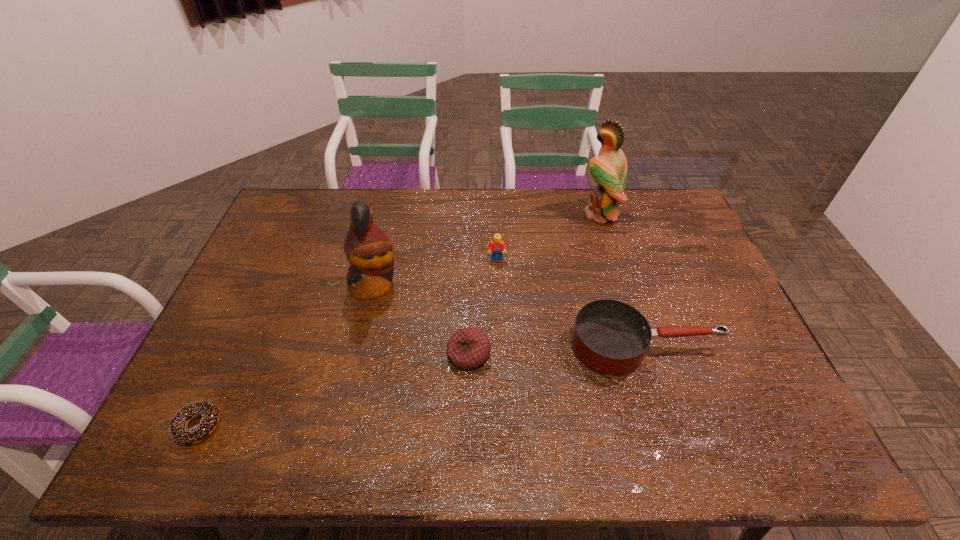
This screenshot has height=540, width=960. Identify the location of object that is at the right edge. (611, 337).

Image resolution: width=960 pixels, height=540 pixels. I want to click on object at the near left corner, so click(x=178, y=430).

The image size is (960, 540). What are the coordinates of `vacant space at the far edge` in the screenshot? It's located at (525, 217).

The height and width of the screenshot is (540, 960). I want to click on vacant space at the near edge of the desktop, so click(641, 427).

Identify the location of blank area at the left edge. This screenshot has width=960, height=540. (262, 258).

In the image, there is a desktop. Where is `free region at the right edge`? The width and height of the screenshot is (960, 540). free region at the right edge is located at coordinates (691, 320).

This screenshot has width=960, height=540. What are the coordinates of `vacant space at the far left corner of the desktop` in the screenshot? It's located at (313, 190).

At what (x,y) coordinates should I click in order to perform the action: click on free space that is in between the nearer parrot and the nearest object. Please return your answer as a coordinate pair (x, y). The image size is (960, 540). Looking at the image, I should click on (286, 356).

At what (x,y) coordinates should I click in order to perform the action: click on blank region between the farthest object and the Lego. Please return your answer as a coordinate pair (x, y). Looking at the image, I should click on (548, 237).

Where is `blank region between the third tallest object and the pan`? This screenshot has height=540, width=960. blank region between the third tallest object and the pan is located at coordinates 571,302.